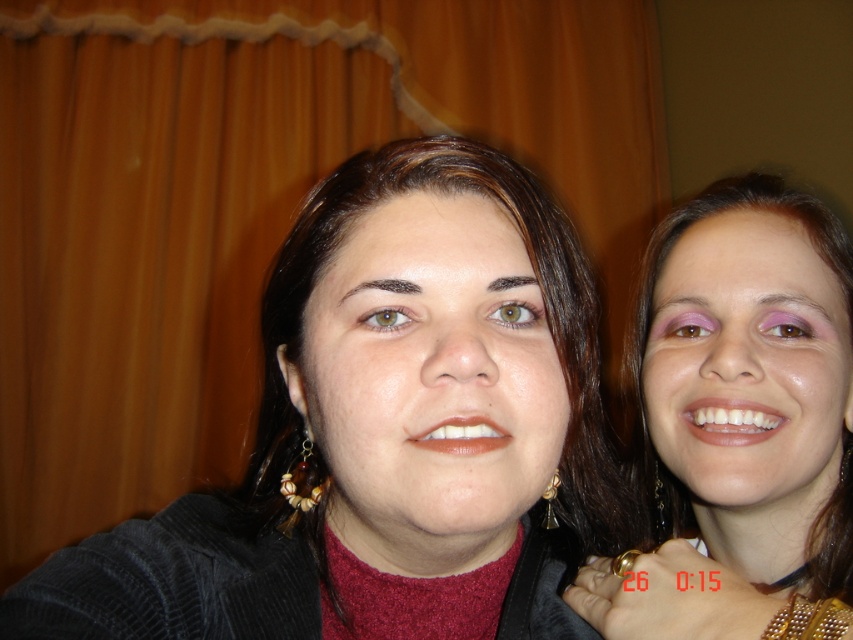
Between matte black sweater at center and matte black hair at right, which one is positioned lower?

matte black sweater at center is lower down.

Does point (619, 513) come farther from viewer compared to point (741, 540)?

No, it is not.

I want to click on matte black sweater at center, so click(386, 432).

This screenshot has width=853, height=640. What are the coordinates of `matte black sweater at center` in the screenshot? It's located at (386, 432).